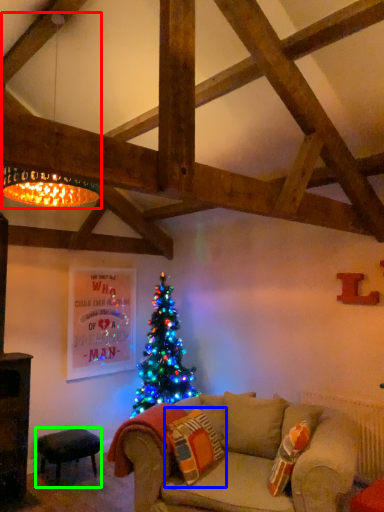
Question: Estimate the real-world distances between objects in this image. Which object is farther from lamp (highlighted by a red box), pillow (highlighted by a blue box) or stool (highlighted by a green box)?

Choices:
 (A) pillow
 (B) stool

Answer: (B)